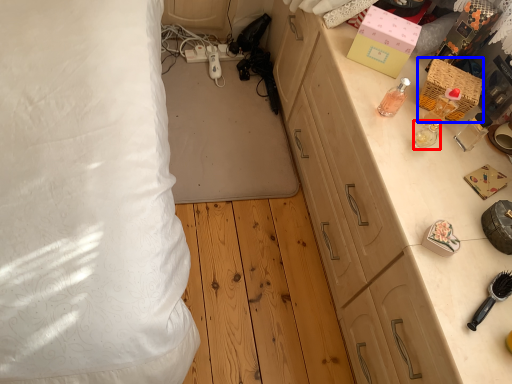
Question: Which object appears closest to the camera in this image, perfume (highlighted by a red box) or box (highlighted by a blue box)?

Choices:
 (A) perfume
 (B) box

Answer: (A)